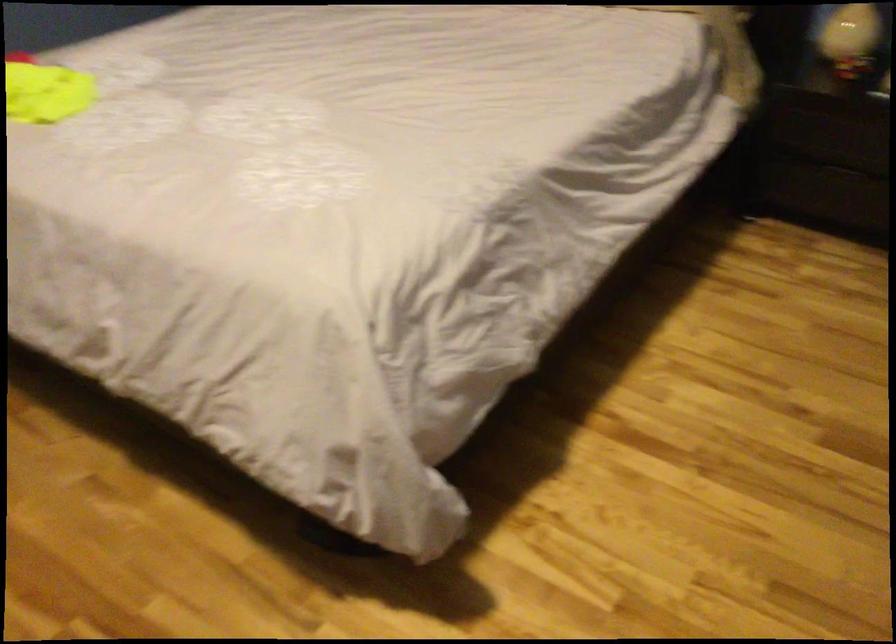
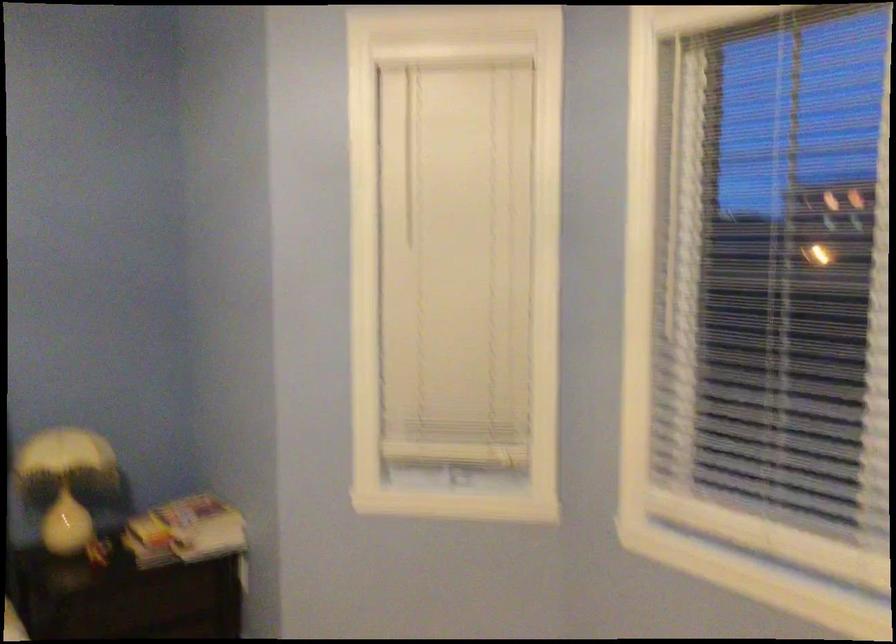
Question: Based on the continuous images, in which direction is the camera rotating? Reply with the corresponding letter.

Choices:
 (A) Left
 (B) Right
 (C) Up
 (D) Down

Answer: (B)